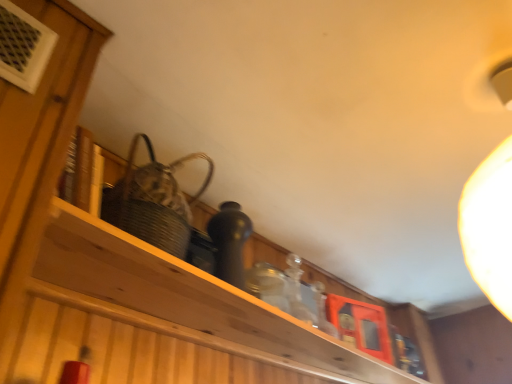
Find the location of a particular element. The width and height of the screenshot is (512, 384). wooden shelf at upper center is located at coordinates [x=188, y=295].

Describe the element at coordinates (188, 295) in the screenshot. The height and width of the screenshot is (384, 512). I see `wooden shelf at upper center` at that location.

Find the location of `wooden shelf at upper center`. wooden shelf at upper center is located at coordinates (188, 295).